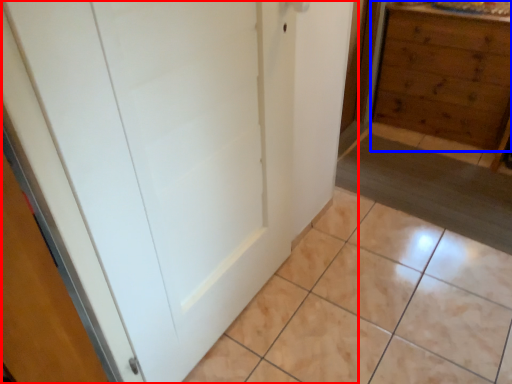
Question: Among these objects, which one is farthest to the camera, door (highlighted by a red box) or chest of drawers (highlighted by a blue box)?

Choices:
 (A) door
 (B) chest of drawers

Answer: (B)